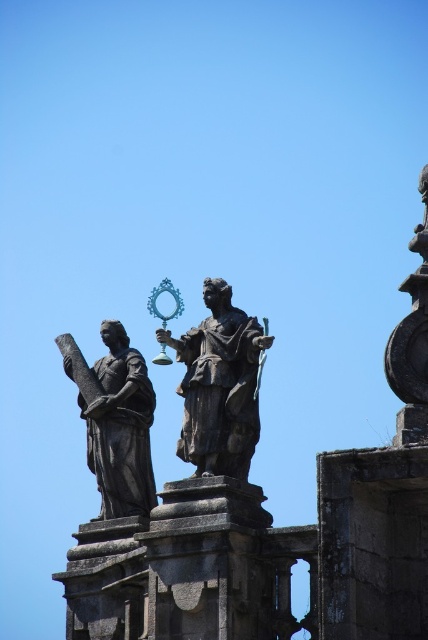
You are an art conservator assessing the statues in the image. Which statue would require a smaller protective display case, the polished bronze statue at center or the dark brown stone statue at upper center?

The polished bronze statue at center has a smaller size compared to the dark brown stone statue at upper center, so it would require a smaller protective display case.

You are standing in front of the stone structure with two statues. You want to touch the polished bronze statue at center and the dark brown stone statue at upper center. Which statue will require you to reach higher to touch?

The dark brown stone statue at upper center requires reaching higher because it is positioned further away from the viewer compared to the polished bronze statue at center, which is closer.

You are an art conservator assessing the statues in the image. You need to determine which statue has a smaller width for a restoration project. Based on the statues labeled as polished bronze statue at center and dark brown stone statue at upper center, which one should you prioritize if you have limited resources for narrower statues?

The polished bronze statue at center is thinner than the dark brown stone statue at upper center, so you should prioritize restoring the polished bronze statue at center since it has a smaller width and requires fewer resources.